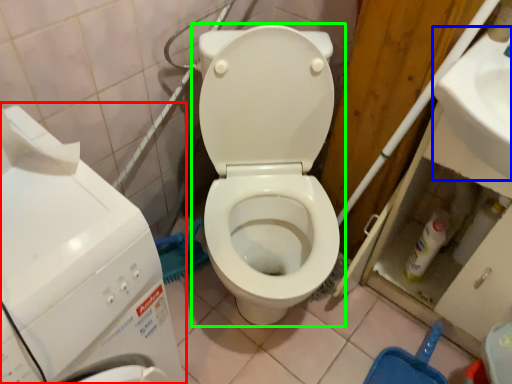
Question: Which object is positioned farthest from washing machine (highlighted by a red box)? Select from sink (highlighted by a blue box) and toilet (highlighted by a green box).

Choices:
 (A) sink
 (B) toilet

Answer: (A)